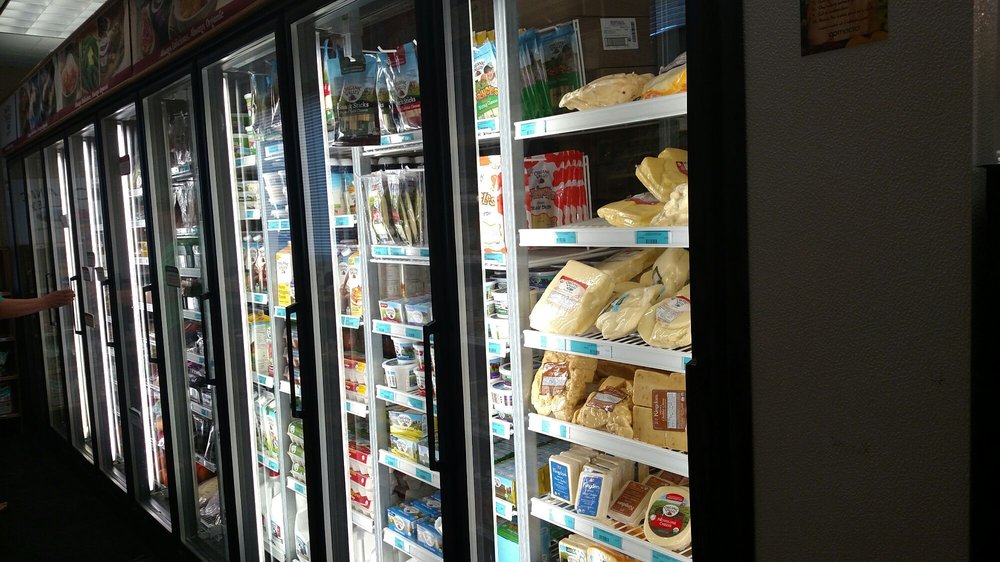
Locate an element on the screen. The image size is (1000, 562). wall is located at coordinates (853, 403).